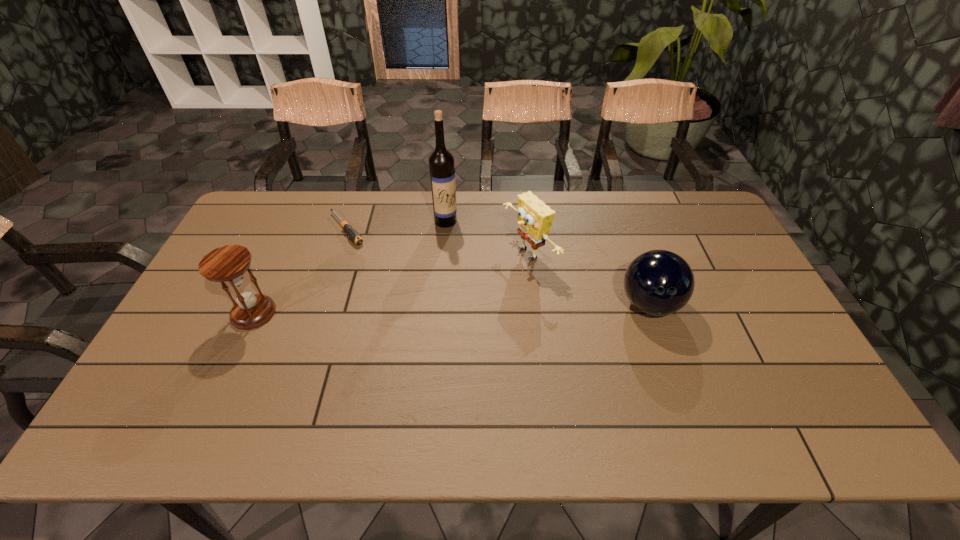
Where is `vacant spot on the desktop that is between the hourglass and the bowling ball and is positioned on the label of the third object from right to left`? vacant spot on the desktop that is between the hourglass and the bowling ball and is positioned on the label of the third object from right to left is located at coordinates (482, 308).

The height and width of the screenshot is (540, 960). What are the coordinates of `free spot on the desktop that is between the hourglass and the bowling ball and is positioned at the tip of the screwdriver` in the screenshot? It's located at (417, 309).

Image resolution: width=960 pixels, height=540 pixels. Find the location of `vacant spot on the desktop that is between the hourglass and the rightmost object and is positioned on the face of the fourth object from left to right`. vacant spot on the desktop that is between the hourglass and the rightmost object and is positioned on the face of the fourth object from left to right is located at coordinates (408, 309).